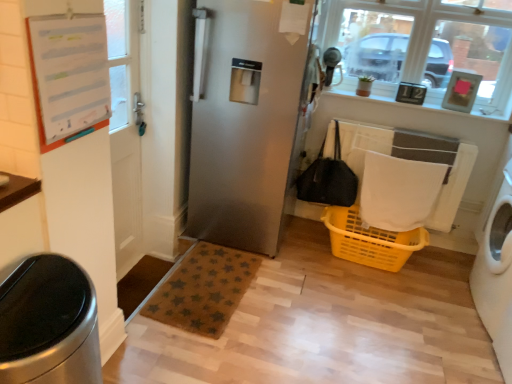
Question: From a real-world perspective, relative to satin silver refrigerator at center, is black fabric bag at center vertically above or below?

Choices:
 (A) below
 (B) above

Answer: (A)

Question: In the image, is black fabric bag at center on the left side or the right side of satin silver refrigerator at center?

Choices:
 (A) left
 (B) right

Answer: (B)

Question: Which object is positioned farthest from the clear glass window at upper right?

Choices:
 (A) brushed metal trash can at lower left
 (B) brown textured mat at lower left
 (C) satin silver refrigerator at center
 (D) white textured towel at right
 (E) white plastic washing machine at right

Answer: (A)

Question: Which object is the farthest from the white paper at upper left?

Choices:
 (A) white plastic washing machine at right
 (B) black fabric bag at center
 (C) brown textured mat at lower center
 (D) brown textured mat at lower left
 (E) yellow plastic laundry basket at lower center

Answer: (A)